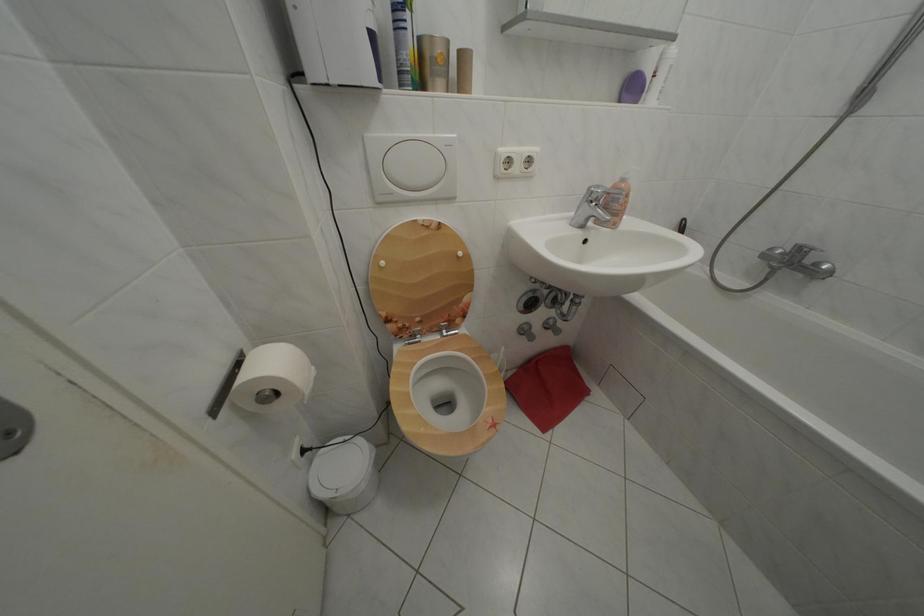
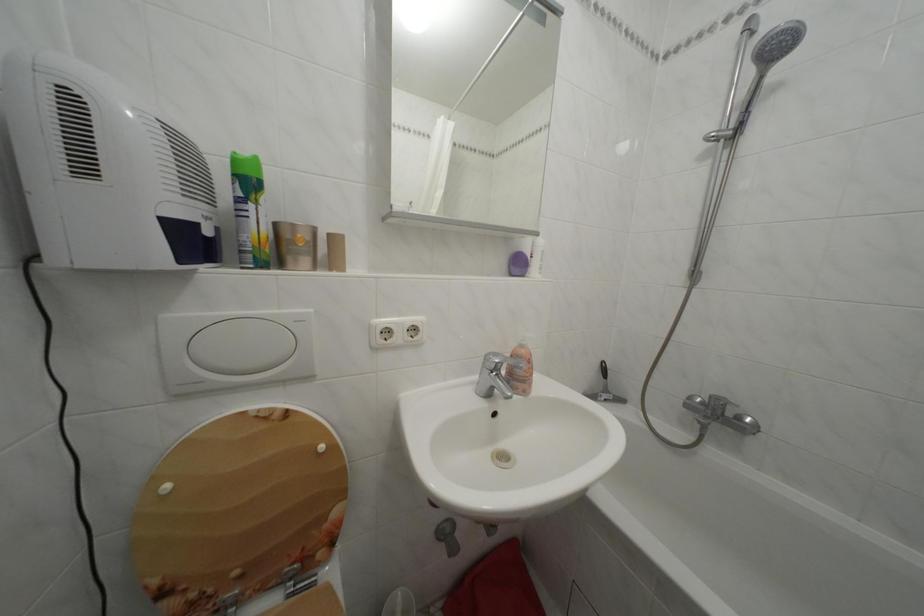
In the second image, find the point that corresponds to the point at 641,95 in the first image.

(527, 270)